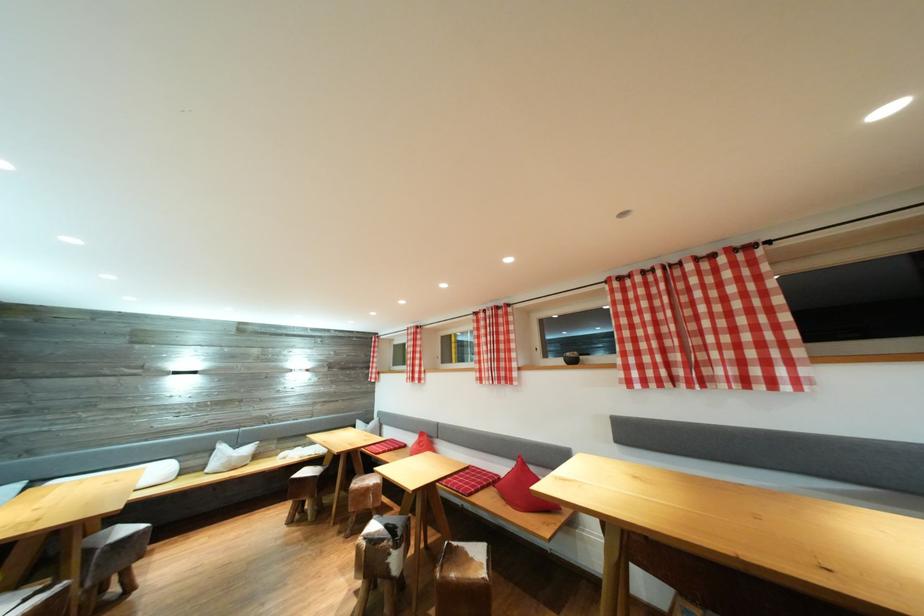
Identify the location of sofa sitting surface. This screenshot has height=616, width=924. (426, 451).